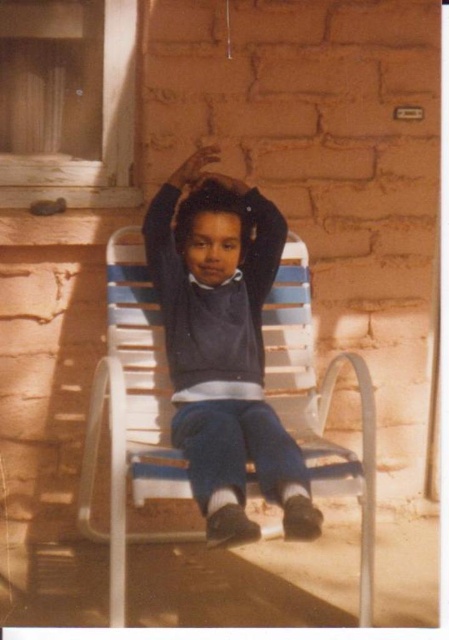
You are a photographer trying to capture a candid shot of the child. You notice the matte blue pants at center and the matte black hand at upper center in your viewfinder. Based on their positions, is there a risk that the hand might accidentally block the pants in the photo?

The matte blue pants at center is 18.08 inches away from the matte black hand at upper center, so there is no risk of the hand blocking the pants in the photo since they are sufficiently spaced apart.

You are a photographer setting up a shot of the scene. You want to position a light source to the left of the white plastic chair at center so it illuminates the matte black hand at upper center. Is the light source placement possible without moving the chair?

The white plastic chair at center is to the right of the matte black hand at upper center. Therefore, placing the light source to the left of the white plastic chair at center would naturally be to the left of the chair, which is also to the left of the hand. This placement would cast light towards the hand, so yes, it is possible without moving the chair.